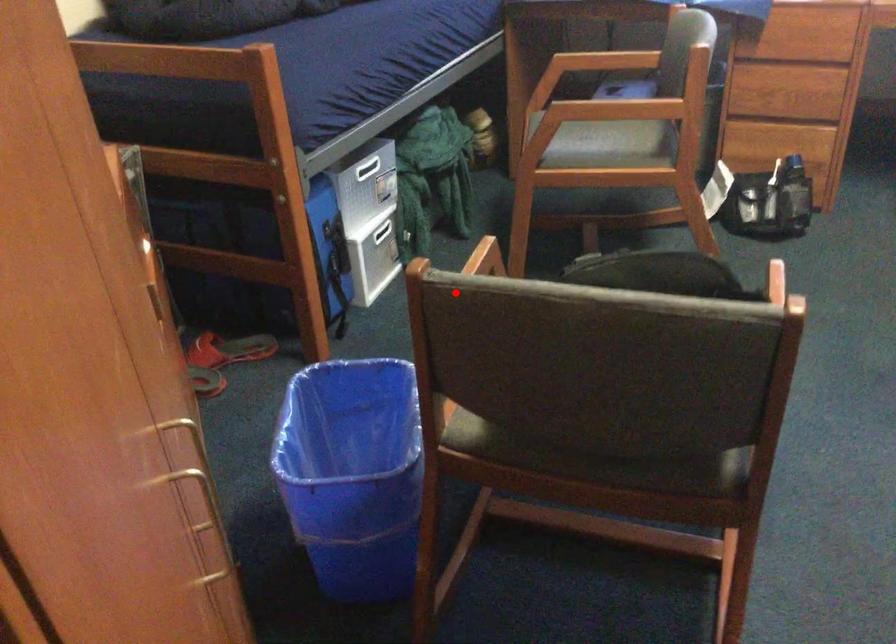
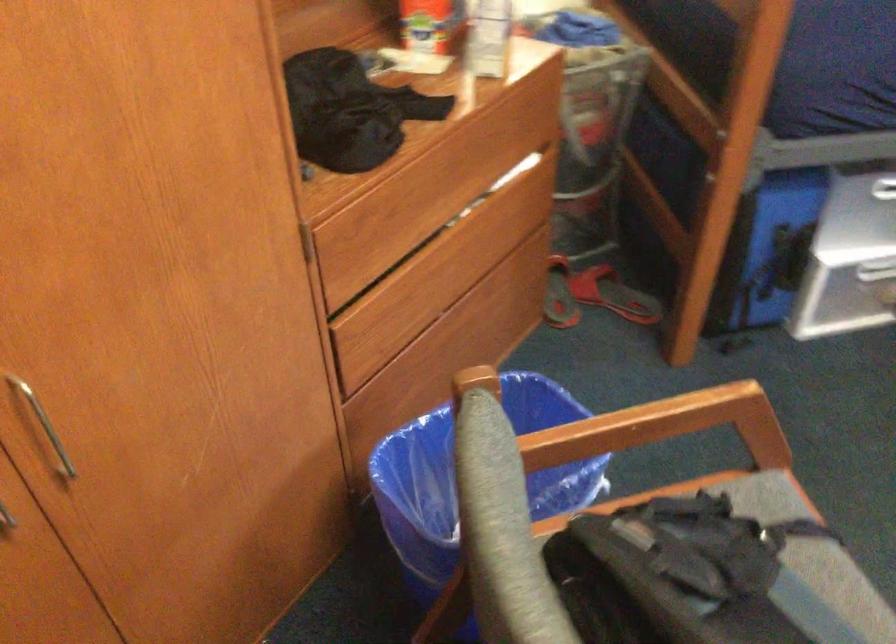
In the second image, find the point that corresponds to the highlighted location in the first image.

(471, 475)